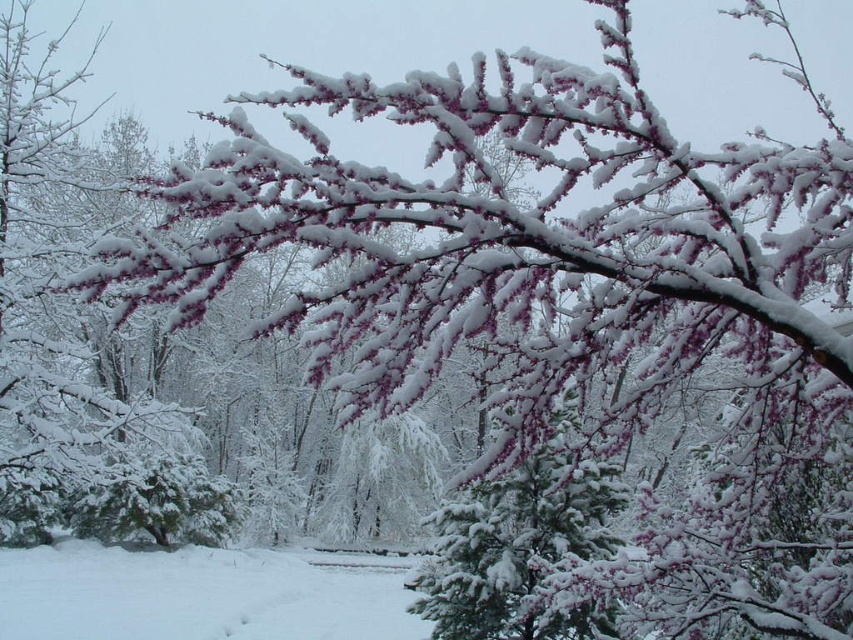
Question: Does white fluffy snow at lower center have a lesser width compared to white fluffy snow-covered tree at center?

Choices:
 (A) no
 (B) yes

Answer: (A)

Question: Which of the following is the farthest from the observer?

Choices:
 (A) white fluffy snow-covered tree at center
 (B) white fluffy snow at lower center

Answer: (B)

Question: Is white fluffy snow at lower center above white fluffy snow-covered tree at center?

Choices:
 (A) no
 (B) yes

Answer: (A)

Question: Can you confirm if white fluffy snow at lower center is bigger than white fluffy snow-covered tree at center?

Choices:
 (A) no
 (B) yes

Answer: (B)